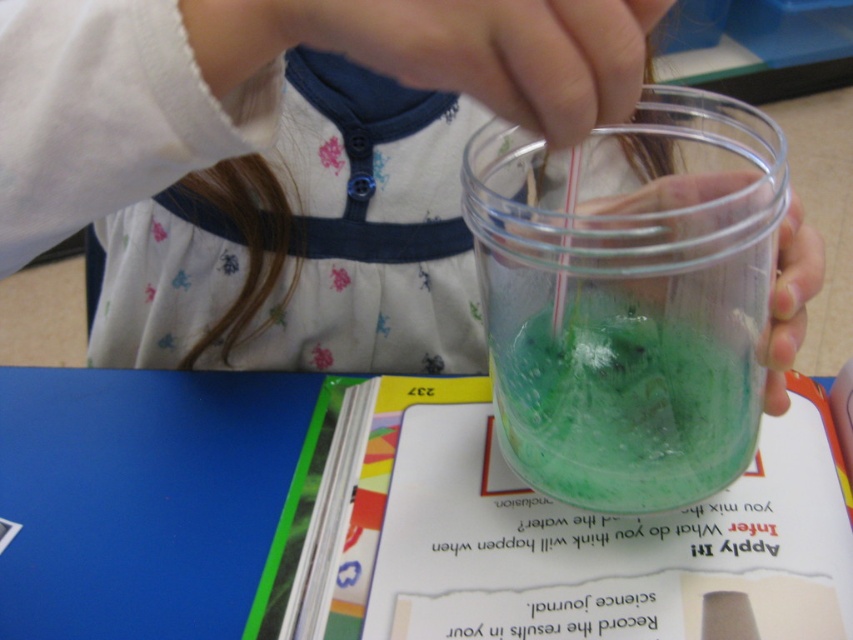
Question: Does translucent plastic cup at center have a lesser width compared to translucent green liquid at center?

Choices:
 (A) yes
 (B) no

Answer: (B)

Question: Is translucent plastic cup at center closer to camera compared to translucent green liquid at center?

Choices:
 (A) yes
 (B) no

Answer: (A)

Question: Does translucent plastic cup at center have a larger size compared to translucent green liquid at center?

Choices:
 (A) no
 (B) yes

Answer: (B)

Question: Which point is closer to the camera?

Choices:
 (A) (688, 403)
 (B) (621, 189)

Answer: (A)

Question: Among these objects, which one is farthest from the camera?

Choices:
 (A) translucent plastic cup at center
 (B) translucent green liquid at center

Answer: (B)

Question: Among these objects, which one is farthest from the camera?

Choices:
 (A) translucent plastic cup at center
 (B) translucent green liquid at center

Answer: (B)